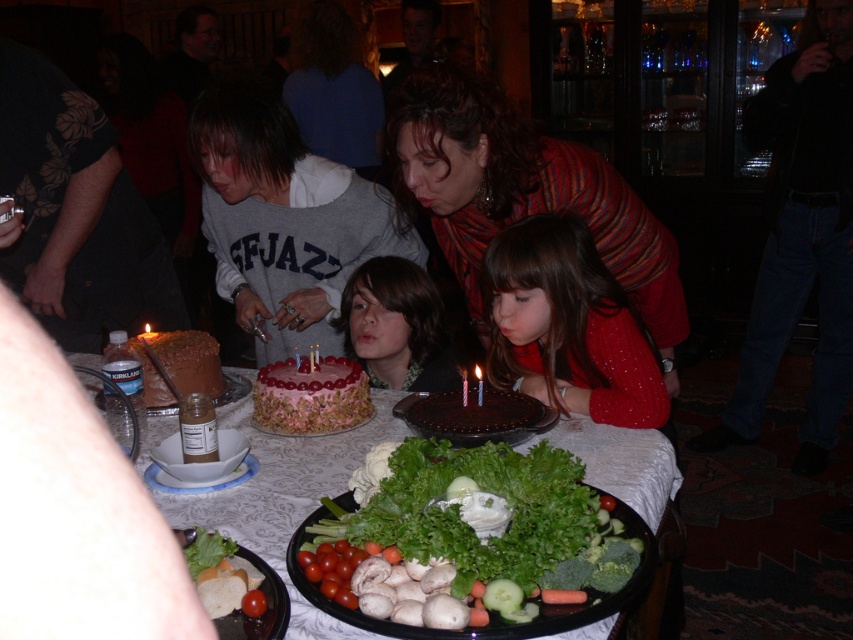
Can you confirm if green leafy vegetables at center is positioned to the left of smooth pink cake at center?

Correct, you'll find green leafy vegetables at center to the left of smooth pink cake at center.

Is green leafy vegetables at center taller than smooth pink cake at center?

Incorrect, green leafy vegetables at center's height is not larger of smooth pink cake at center's.

Find the location of `green leafy vegetables at center`. green leafy vegetables at center is located at coordinates coord(286,497).

Is striped sweater at center above translucent plastic candle at center?

Yes.

Between striped sweater at center and translucent plastic candle at center, which one appears on the left side from the viewer's perspective?

From the viewer's perspective, translucent plastic candle at center appears more on the left side.

Is point (648, 237) positioned before point (479, 394)?

No, (648, 237) is further to viewer.

Identify the location of striped sweater at center. This screenshot has width=853, height=640. (519, 189).

Is striped sweater at center behind green leafy lettuce at center?

Yes, it is behind green leafy lettuce at center.

Can you confirm if striped sweater at center is thinner than green leafy lettuce at center?

No.

Identify the location of striped sweater at center. This screenshot has width=853, height=640. coord(519,189).